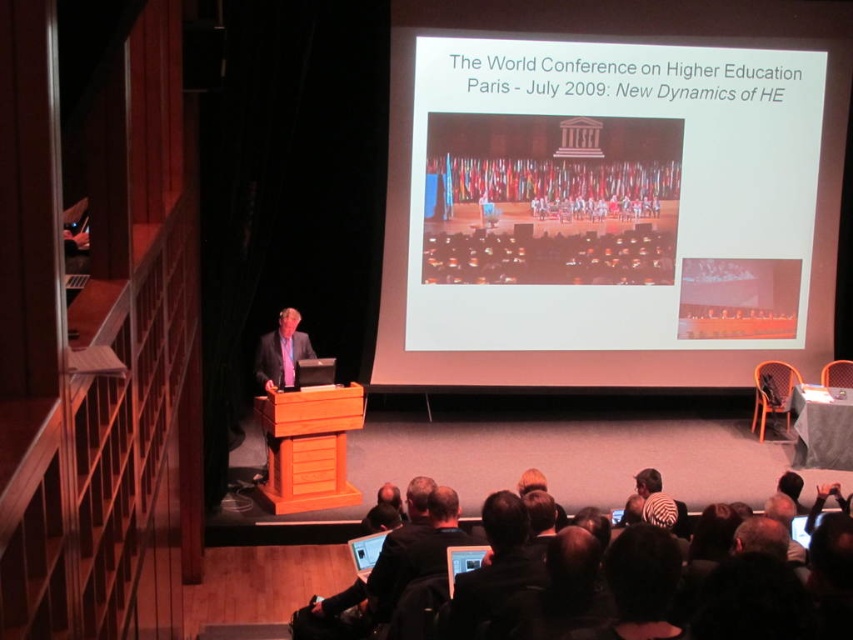
You are an event technician who needs to connect a cable from the matte black laptop at lower center to the matte black screen at center. Based on the scene, can you determine if the cable will reach without needing an extension?

The matte black screen at center is closer to the viewer than the matte black laptop at lower center, so the distance between them is likely short enough for the cable to reach without needing an extension.

You are an event organizer who needs to set up a new projector. The projector requires a surface that is larger than the matte black laptop at lower center. Can the matte black screen at center be used as the projection surface?

The matte black screen at center occupies less space than the matte black laptop at lower center. Therefore, it cannot be used as the projection surface since it is smaller than the required size.

You are an event technician who needs to connect the matte black laptop at lower center to the matte black screen at center. The cable you have is 1.1 meters long. Will it be long enough to connect them without any extension?

The distance between the matte black screen at center and the matte black laptop at lower center is 1.19 meters. Since the cable is only 1.1 meters long, it is 0.09 meters shorter than needed. Therefore, the cable will not be long enough to connect them without an extension.